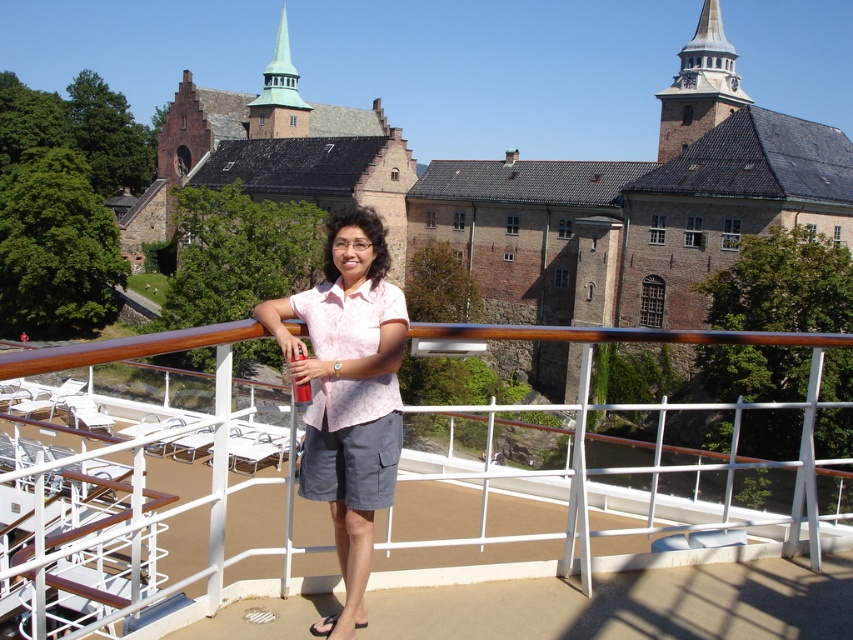
Question: Is pink floral shirt at center bigger than white metal railing at center?

Choices:
 (A) yes
 (B) no

Answer: (B)

Question: Is pink floral shirt at center smaller than white metal railing at center?

Choices:
 (A) yes
 (B) no

Answer: (A)

Question: Considering the relative positions of pink floral shirt at center and white metal railing at center in the image provided, where is pink floral shirt at center located with respect to white metal railing at center?

Choices:
 (A) above
 (B) below

Answer: (A)

Question: Which point appears closest to the camera in this image?

Choices:
 (A) (105, 358)
 (B) (318, 330)

Answer: (A)

Question: Which point is closer to the camera?

Choices:
 (A) white metal railing at center
 (B) pink floral shirt at center

Answer: (A)